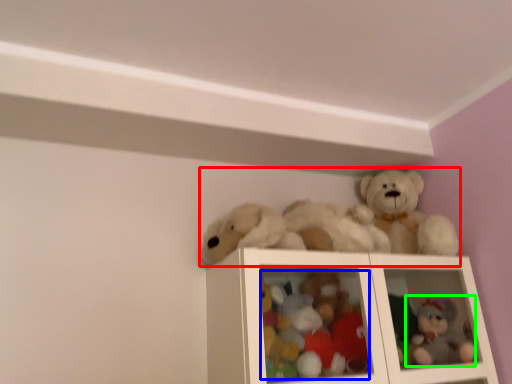
Question: Based on their relative distances, which object is nearer to toy (highlighted by a red box)? Choose from toy (highlighted by a blue box) and toy (highlighted by a green box).

Choices:
 (A) toy
 (B) toy

Answer: (A)